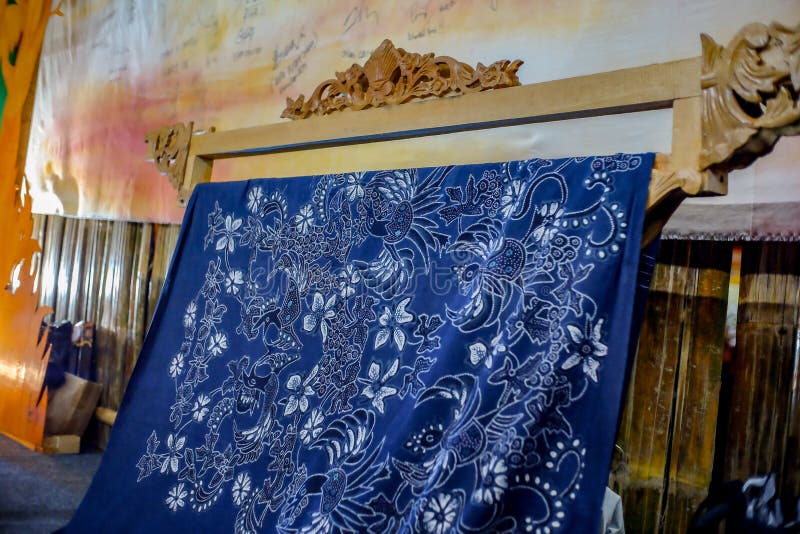
At what (x,y) coordinates should I click in order to perform the action: click on the top of shelf. Please return your answer as a coordinate pair (x, y). The height and width of the screenshot is (534, 800). Looking at the image, I should click on (410, 68).